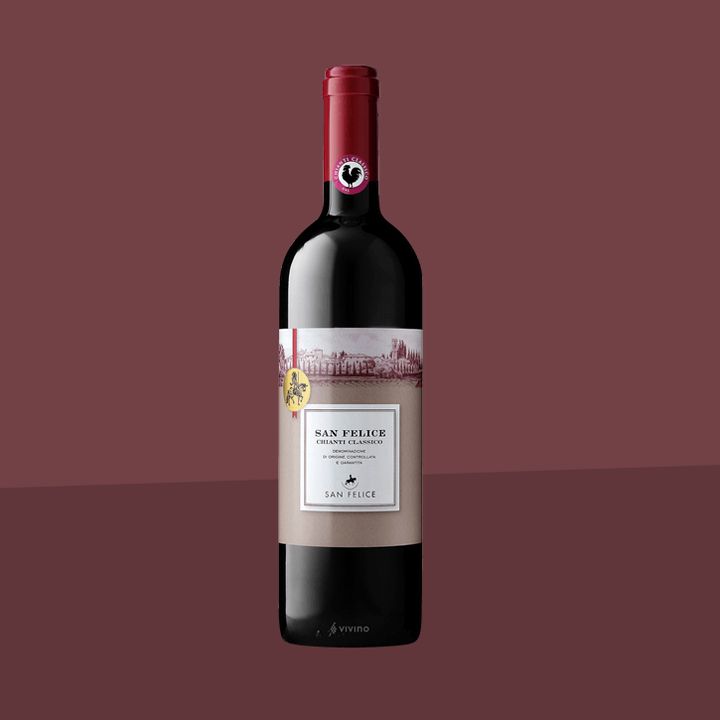
At what (x,y) coordinates should I click in order to perform the action: click on wine bottle. Please return your answer as a coordinate pair (x, y). Looking at the image, I should click on (379, 590).